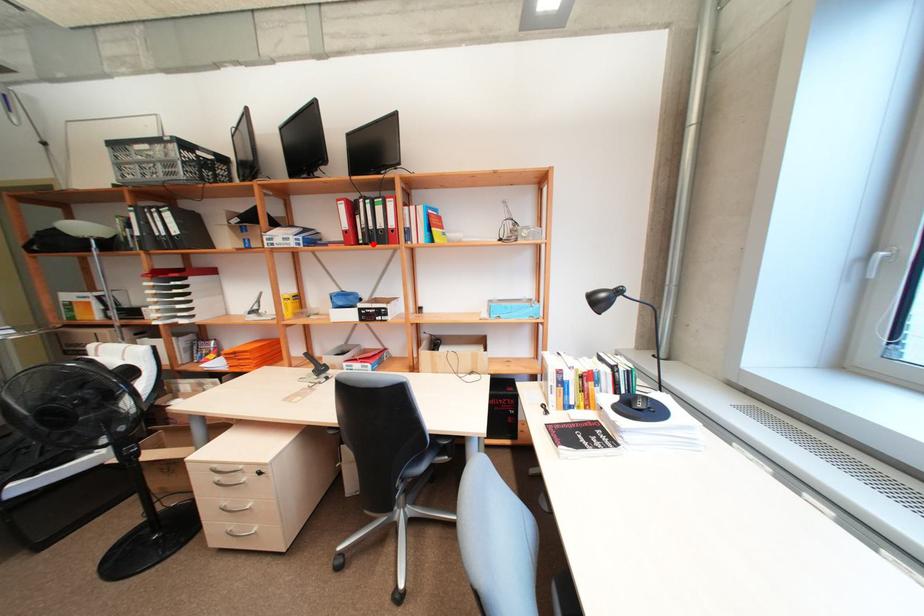
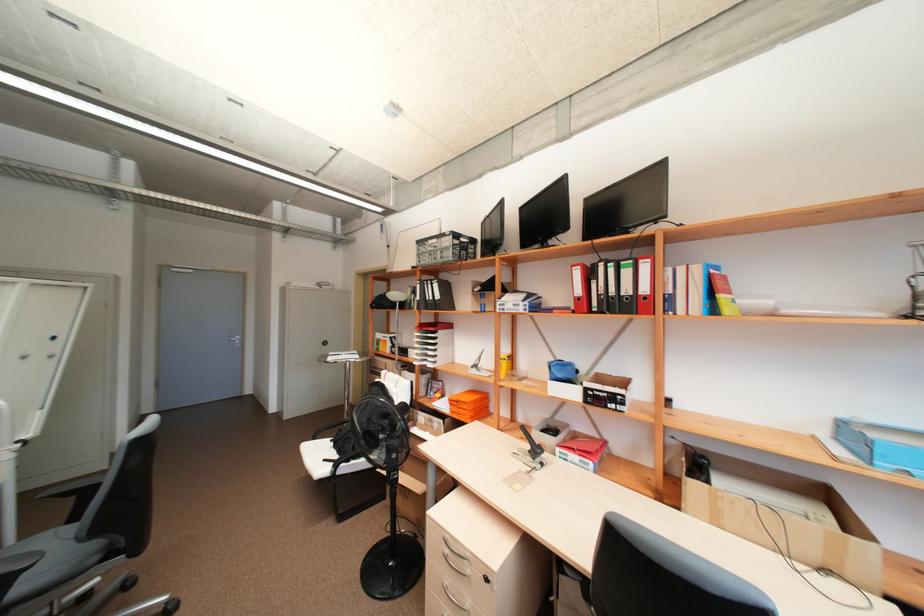
Find the pixel in the second image that matches the highlighted location in the first image.

(610, 313)